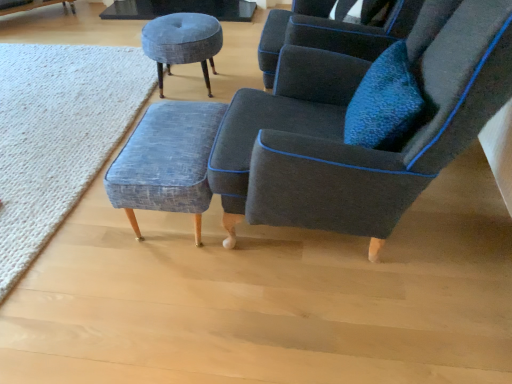
Locate an element on the screen. blank space situated above textured blue fabric stool at center, acting as the first stool starting from the front (from a real-world perspective) is located at coordinates (170, 135).